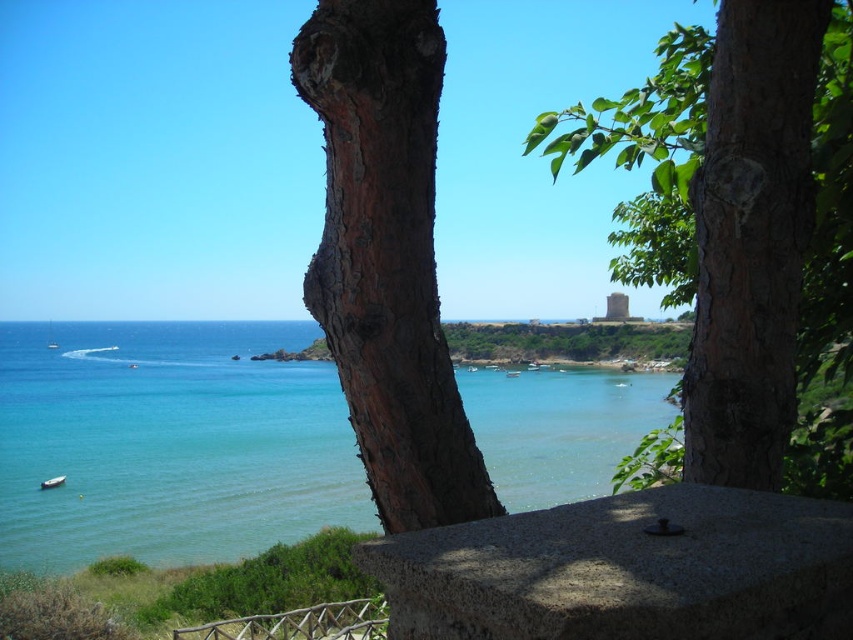
You are standing at the edge of a coastal path and see the brown rough bark tree at center and the gray stone balustrade at lower center. Which object is closer to your right side?

The brown rough bark tree at center is positioned on the right side of the gray stone balustrade at lower center, so it is closer to your right side.